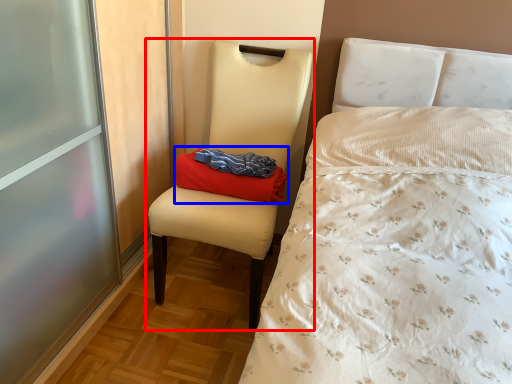
Question: Which object is closer to the camera taking this photo, chair (highlighted by a red box) or pillow (highlighted by a blue box)?

Choices:
 (A) chair
 (B) pillow

Answer: (A)